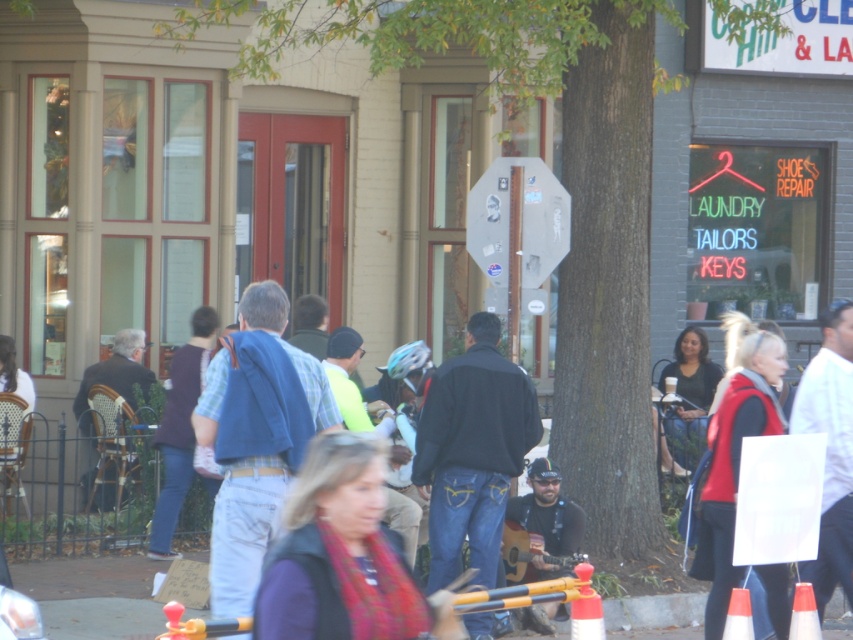
Is matte black jacket at center further to the viewer compared to dark brown leather jacket at left?

Yes, it is.

Does matte black jacket at center appear under dark brown leather jacket at left?

Incorrect, matte black jacket at center is not positioned below dark brown leather jacket at left.

Identify the location of matte black jacket at center. This screenshot has width=853, height=640. (689, 394).

What are the coordinates of `matte black jacket at center` in the screenshot? It's located at (689, 394).

Is point (300, 595) positioned behind point (601, 618)?

That is False.

Which is behind, point (257, 637) or point (585, 600)?

Point (585, 600)

Which is behind, point (335, 461) or point (589, 621)?

The point (589, 621) is more distant.

I want to click on purple matte vest at center, so click(338, 554).

How much distance is there between brown textured tree at center and stained glass stop sign at center?

The distance of brown textured tree at center from stained glass stop sign at center is 3.32 feet.

Which of these two, brown textured tree at center or stained glass stop sign at center, stands shorter?

Standing shorter between the two is stained glass stop sign at center.

Is point (654, 513) farther from viewer compared to point (537, 161)?

Yes.

Find the location of a particular element. brown textured tree at center is located at coordinates (561, 182).